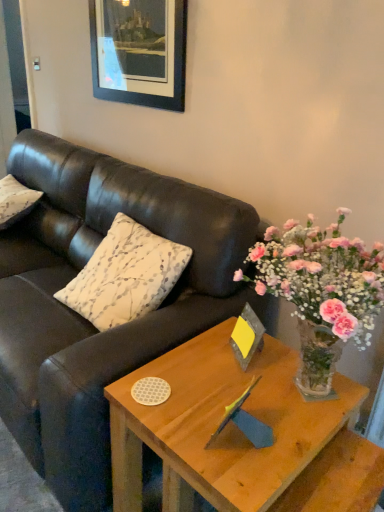
You are a GUI agent. You are given a task and a screenshot of the screen. Output one action in this format:
    pyautogui.click(x=<x>, y=<y>)
    Task: Click on the free space in front of wooden block with yellow card at center, placed as the 2th picture frame when sorted from top to bottom
    
    Given the screenshot: What is the action you would take?
    pyautogui.click(x=255, y=393)